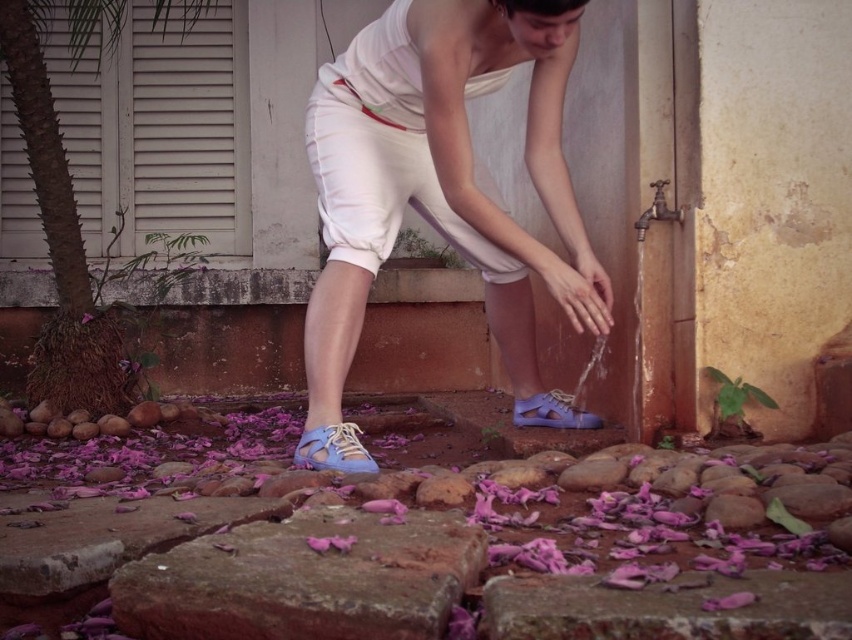
Question: Can you confirm if matte purple shoe at lower center is wider than purple matte flower at lower left?

Choices:
 (A) no
 (B) yes

Answer: (B)

Question: Estimate the real-world distances between objects in this image. Which object is farther from the matte blue sandal at lower left?

Choices:
 (A) matte white shorts at center
 (B) matte purple shoe at lower center

Answer: (B)

Question: Does matte blue sandal at lower left have a smaller size compared to matte purple shoe at lower center?

Choices:
 (A) yes
 (B) no

Answer: (B)

Question: Estimate the real-world distances between objects in this image. Which object is farther from the matte white shorts at center?

Choices:
 (A) matte purple shoe at lower center
 (B) purple matte flower at lower left
 (C) matte blue sandal at lower left

Answer: (B)

Question: Is matte white shorts at center smaller than purple matte flower at lower left?

Choices:
 (A) no
 (B) yes

Answer: (A)

Question: Which object is positioned closest to the matte white shorts at center?

Choices:
 (A) purple matte flower at lower left
 (B) matte purple shoe at lower center
 (C) matte blue sandal at lower left

Answer: (C)